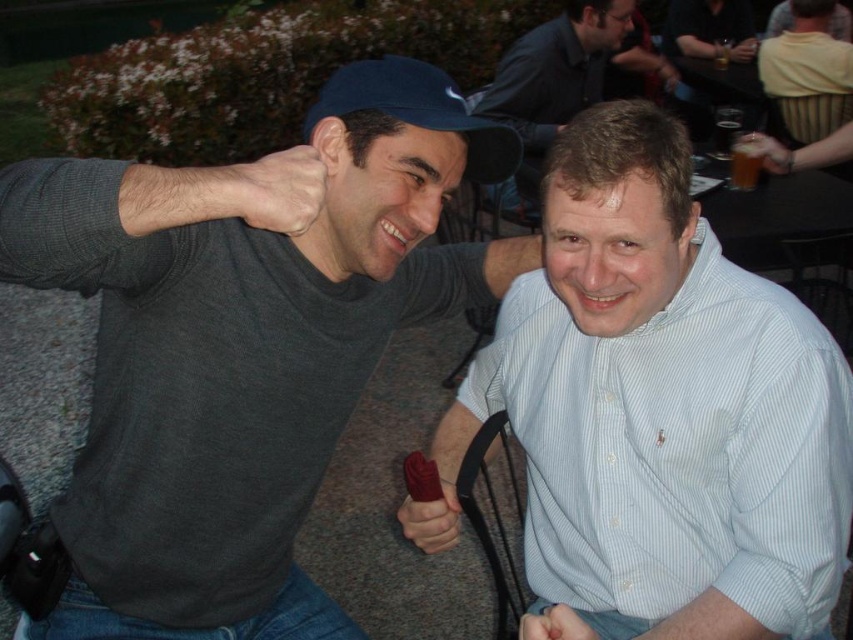
You are a bartender at a party and see the matte black fist at lower center and the matte brown glass at upper right in your line of sight. Which object is closer to you?

The matte black fist at lower center is closer to you because it is in front of the matte brown glass at upper right.

You are a photographer at this event and want to capture a photo where the light blue striped shirt at center and the white matte hand at upper center are both visible. Based on their positions, which object should appear to the right in the final photo?

The light blue striped shirt at center is positioned on the right side of the white matte hand at upper center, so in the photo, the light blue striped shirt at center will appear to the right of the white matte hand at upper center.